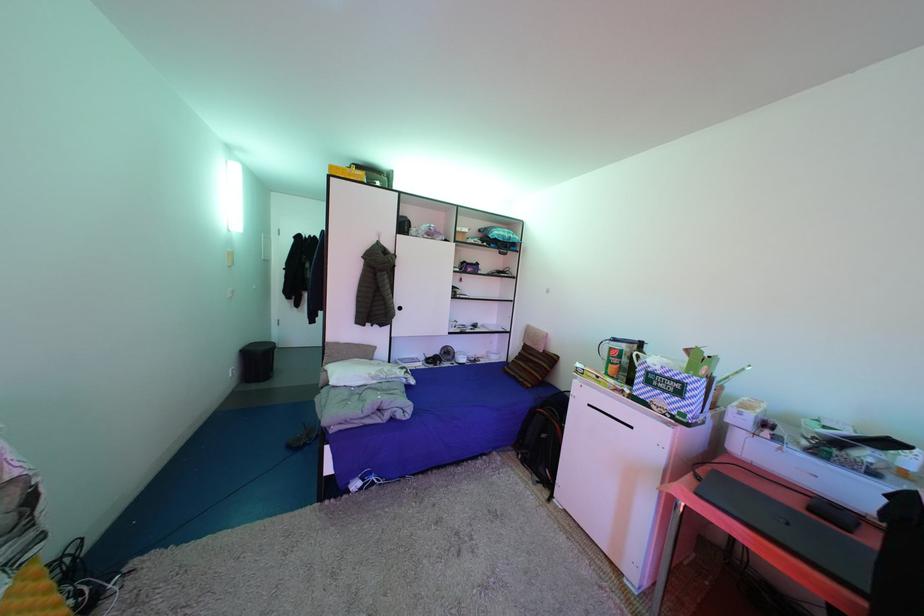
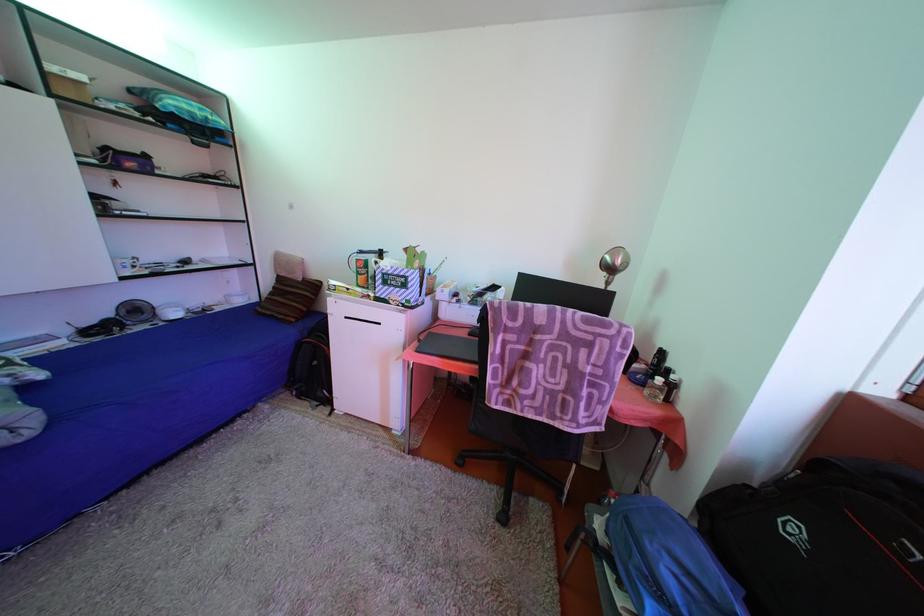
The images are taken continuously from a first-person perspective. In which direction is your viewpoint rotating?

The camera rotated toward right-down.